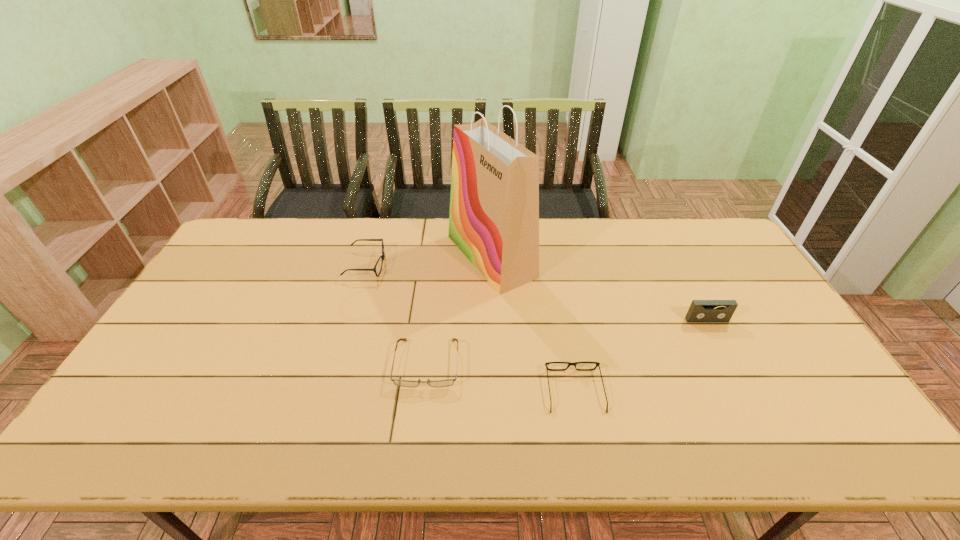
Find the location of a particular element. the tallest object is located at coordinates (494, 204).

Locate an element on the screen. The height and width of the screenshot is (540, 960). the third farthest object is located at coordinates (700, 311).

This screenshot has height=540, width=960. Find the location of `the fourth shortest object`. the fourth shortest object is located at coordinates (700, 311).

You are a GUI agent. You are given a task and a screenshot of the screen. Output one action in this format:
    pyautogui.click(x=<x>, y=<y>)
    Task: Click on the third shortest object
    
    Given the screenshot: What is the action you would take?
    pyautogui.click(x=382, y=256)

Identify the location of the farthest spectacles. (382, 256).

Find the location of a particular element. the second spectacles from left to right is located at coordinates (404, 383).

Locate an element on the screen. The width and height of the screenshot is (960, 540). the rightmost spectacles is located at coordinates (569, 363).

Where is `free spot located 0.380m on the right of the tallest object`? The height and width of the screenshot is (540, 960). free spot located 0.380m on the right of the tallest object is located at coordinates (647, 256).

Locate an element on the screen. The image size is (960, 540). free point located 0.170m on the front-facing side of the rightmost object is located at coordinates (732, 371).

Image resolution: width=960 pixels, height=540 pixels. Identify the location of free space located on the front-facing side of the tallest spectacles. (486, 265).